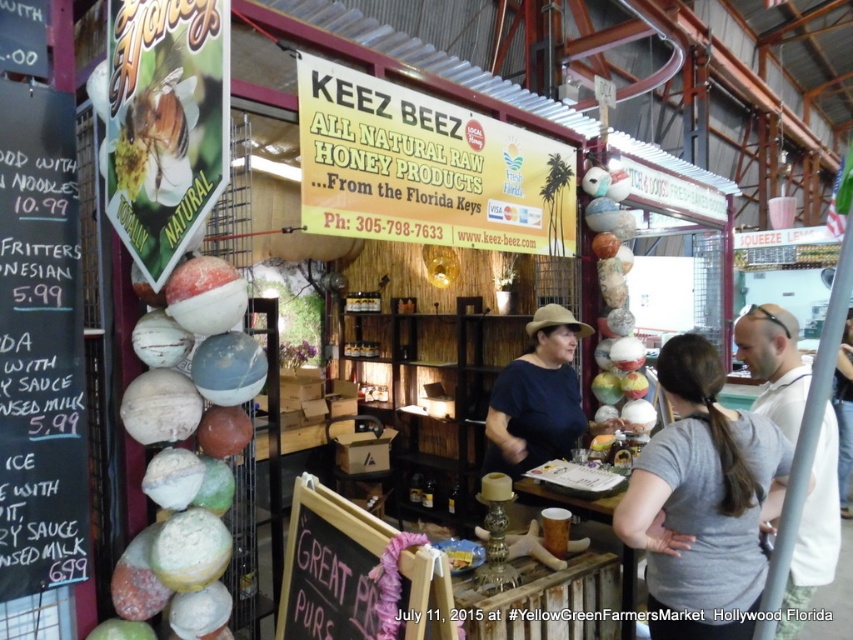
Is the position of black chalkboard menu at left less distant than that of gray fabric shirt at center?

Yes, it is.

Can you confirm if black chalkboard menu at left is bigger than gray fabric shirt at center?

Actually, black chalkboard menu at left might be smaller than gray fabric shirt at center.

Identify the location of black chalkboard menu at left. (39, 346).

Does gray cotton shirt at center have a larger size compared to light gray t-shirt at right?

No.

Who is higher up, gray cotton shirt at center or light gray t-shirt at right?

light gray t-shirt at right is above.

The height and width of the screenshot is (640, 853). Describe the element at coordinates (703, 502) in the screenshot. I see `gray cotton shirt at center` at that location.

Where is `gray cotton shirt at center`? The image size is (853, 640). gray cotton shirt at center is located at coordinates (703, 502).

Find the location of a particular element. Image resolution: width=853 pixels, height=640 pixels. gray cotton shirt at center is located at coordinates (703, 502).

Which of these two, gray cotton shirt at center or gray fabric shirt at center, stands taller?

With more height is gray fabric shirt at center.

Identify the location of gray cotton shirt at center. This screenshot has height=640, width=853. (703, 502).